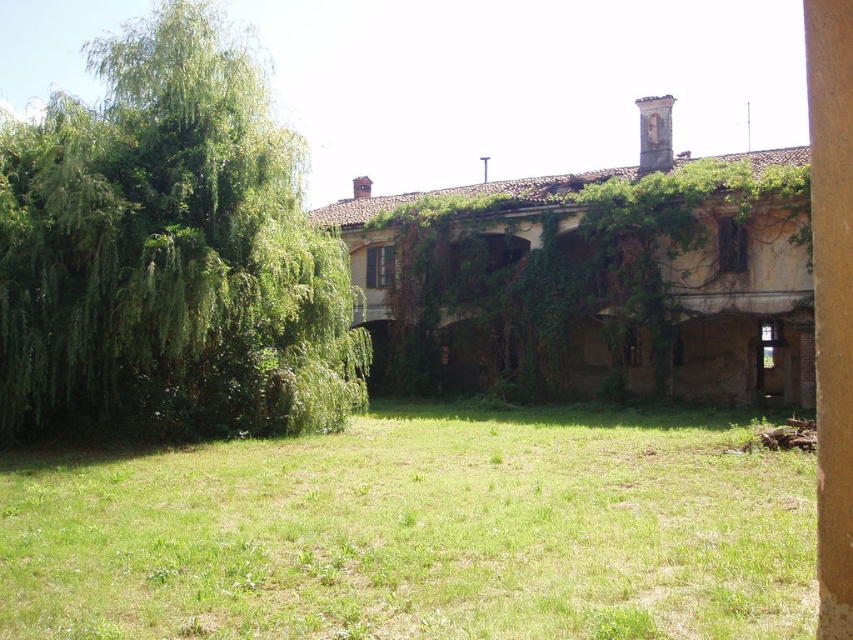
You are standing in front of the old building and want to walk towards the green leafy tree at left. Which direction should you move relative to the green grass at lower center?

Since the green grass at lower center is below the green leafy tree at left, you should move towards the left and upwards from the green grass at lower center to reach the tree.

You are standing in front of the old building and want to walk towards the green leafy tree at left. Which direction should you move relative to the green grass at lower center?

You should move towards the left side of the green grass at lower center since the green leafy tree at left is located to the left of the green grass at lower center.

You are a gardener who wants to mow the green grass at lower center. However, there is a green leafy tree at left nearby. Do you think the tree will interfere with the mowing process?

The green grass at lower center is shorter than the green leafy tree at left, so the tree might cast shadows over the grass, but since the grass is shorter, it won not interfere with the mowing process.